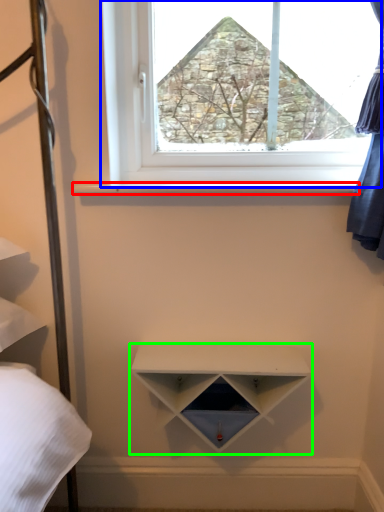
Question: Which is farther away from window sill (highlighted by a red box)? window (highlighted by a blue box) or shelf (highlighted by a green box)?

Choices:
 (A) window
 (B) shelf

Answer: (B)